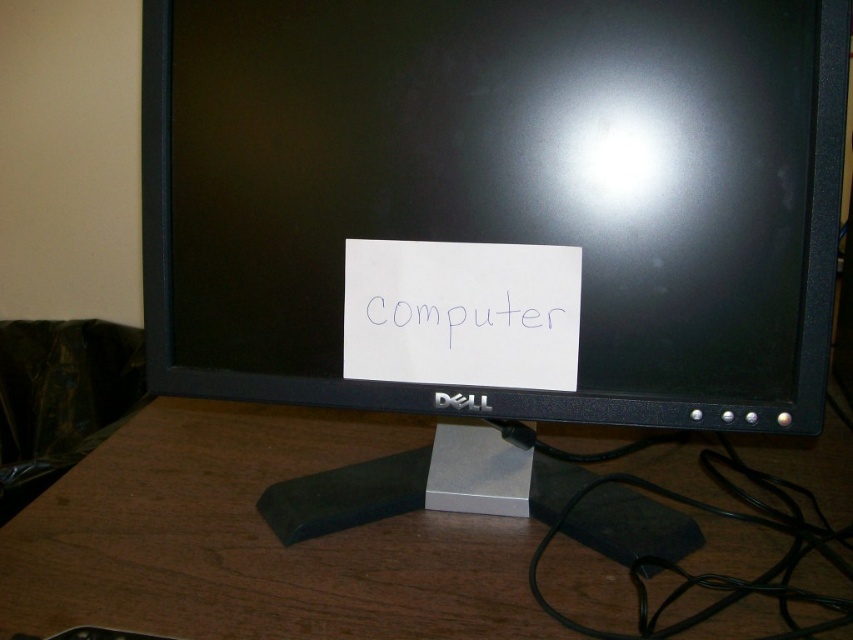
You are trying to attach a sticky note to your monitor. The sticky note is exactly 4 inches wide. The distance between the black plastic monitor at center and the white paper at center is 4.65 inches. Can the sticky note fit between them without overlapping?

The distance between the black plastic monitor at center and the white paper at center is 4.65 inches, which is greater than the sticky note width of 4 inches. Therefore, the sticky note can fit between them without overlapping.

You need to place a Dell computer monitor on the brown wood computer desk at center. Based on the scene description, will the black plastic monitor at center fit on the desk without overhanging the edges?

The black plastic monitor at center has a lesser width compared to brown wood computer desk at center, so it will fit without overhanging the edges.

Looking at this image, you are standing in front of the Dell computer monitor on the wooden desk. There are two points marked on the monitor screen at coordinates point (553, 508) and point (312, 550). Which point is closer to you?

Point (553, 508) is further to the camera than point (312, 550), so the point closer to you is point (312, 550).